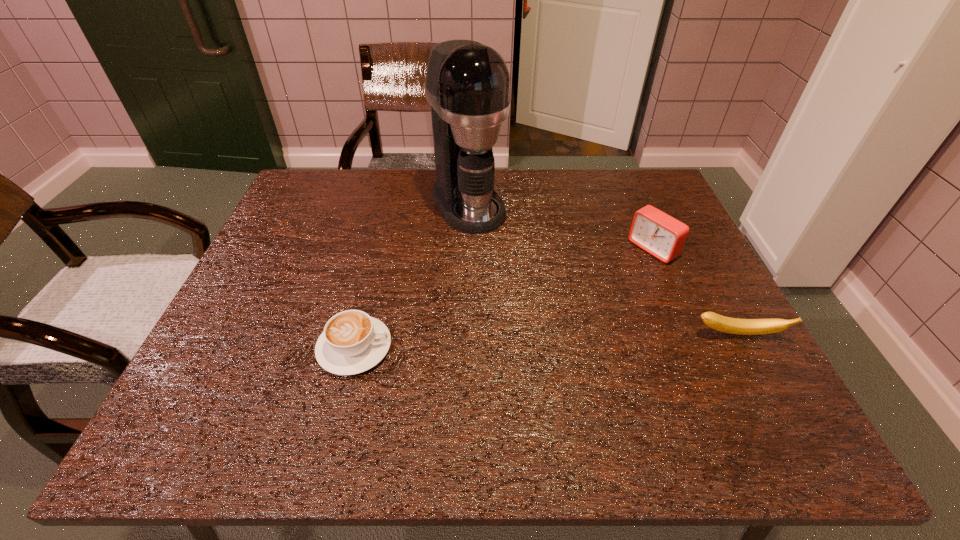
The image size is (960, 540). I want to click on vacant spot on the desktop that is between the leftmost object and the banana and is positioned place cup under the spout of the tallest object, so click(x=563, y=341).

Identify the location of vacant space on the desktop that is between the leftmost object and the banana and is positioned on the front-facing side of the alarm clock. (505, 342).